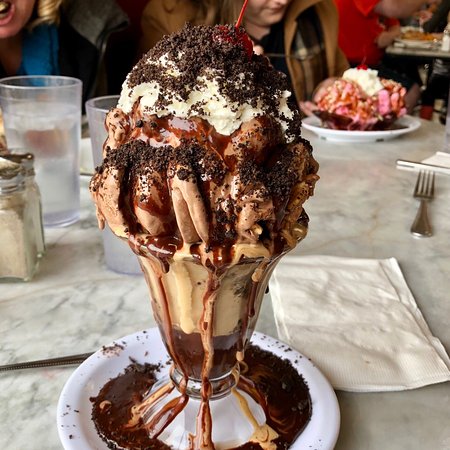
In order to click on fork in this screenshot , I will do `click(423, 201)`.